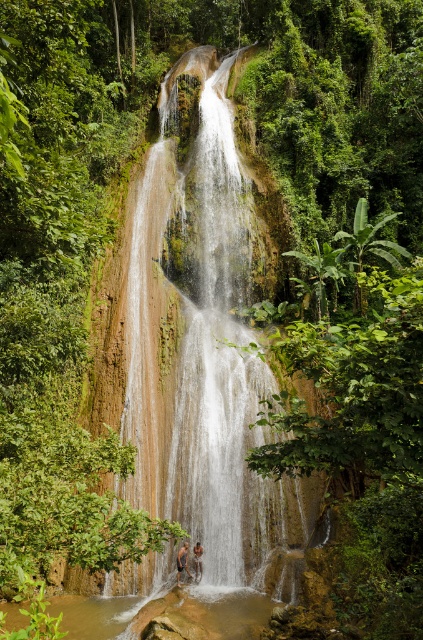
Question: Is green mossy rock at center above brown textured hair at lower center?

Choices:
 (A) yes
 (B) no

Answer: (A)

Question: Which object is farther from the camera taking this photo?

Choices:
 (A) green mossy rock at center
 (B) brown textured skin at center
 (C) brown textured hair at lower center

Answer: (B)

Question: Among these objects, which one is farthest from the camera?

Choices:
 (A) brown textured skin at center
 (B) green mossy rock at center
 (C) brown textured hair at lower center

Answer: (A)

Question: Is green mossy rock at center below brown textured hair at lower center?

Choices:
 (A) yes
 (B) no

Answer: (B)

Question: Which point appears farthest from the camera in this image?

Choices:
 (A) (197, 58)
 (B) (192, 552)

Answer: (A)

Question: Is green mossy rock at center below brown textured skin at center?

Choices:
 (A) yes
 (B) no

Answer: (B)